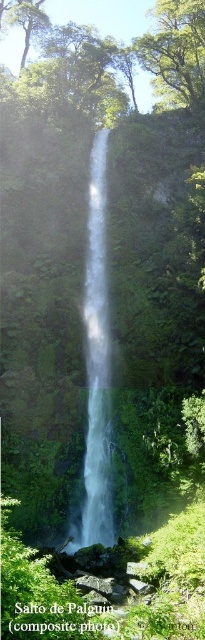
Who is more forward, [93,504] or [151,80]?

Point [93,504]

Is clear glass waterfall at center to the right of green leafy tree at upper center from the viewer's perspective?

No, clear glass waterfall at center is not to the right of green leafy tree at upper center.

Which is behind, point (104, 253) or point (152, 90)?

Positioned behind is point (152, 90).

At what (x,y) coordinates should I click in order to perform the action: click on clear glass waterfall at center. Please return your answer as a coordinate pair (x, y). Looking at the image, I should click on (96, 360).